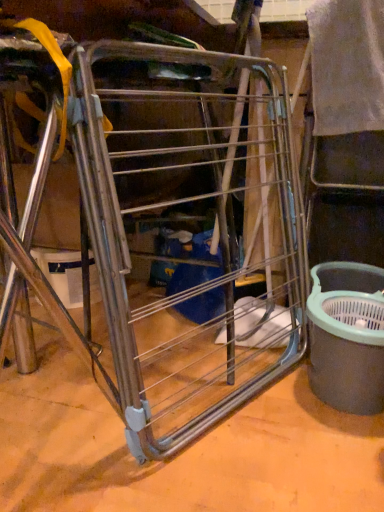
Question: Is metal wire rack at center inside gray plastic bucket at right?

Choices:
 (A) no
 (B) yes

Answer: (A)

Question: Is the depth of gray plastic bucket at right greater than that of metal wire rack at center?

Choices:
 (A) yes
 (B) no

Answer: (A)

Question: Is gray plastic bucket at right bigger than metal wire rack at center?

Choices:
 (A) yes
 (B) no

Answer: (B)

Question: From a real-world perspective, is gray plastic bucket at right below metal wire rack at center?

Choices:
 (A) yes
 (B) no

Answer: (A)

Question: Are gray plastic bucket at right and metal wire rack at center beside each other?

Choices:
 (A) yes
 (B) no

Answer: (B)

Question: Is gray plastic bucket at right not near metal wire rack at center?

Choices:
 (A) no
 (B) yes

Answer: (A)

Question: Does metal wire rack at center touch gray plastic bucket at right?

Choices:
 (A) no
 (B) yes

Answer: (A)

Question: Considering the relative sizes of metal wire rack at center and gray plastic bucket at right in the image provided, is metal wire rack at center shorter than gray plastic bucket at right?

Choices:
 (A) yes
 (B) no

Answer: (B)

Question: Does metal wire rack at center come behind gray plastic bucket at right?

Choices:
 (A) yes
 (B) no

Answer: (B)

Question: Is gray plastic bucket at right at the back of metal wire rack at center?

Choices:
 (A) no
 (B) yes

Answer: (A)

Question: Can you confirm if metal wire rack at center is positioned to the left of gray plastic bucket at right?

Choices:
 (A) yes
 (B) no

Answer: (A)

Question: Does metal wire rack at center have a lesser width compared to gray plastic bucket at right?

Choices:
 (A) no
 (B) yes

Answer: (B)

Question: Does point (344, 394) appear closer or farther from the camera than point (109, 166)?

Choices:
 (A) closer
 (B) farther

Answer: (A)